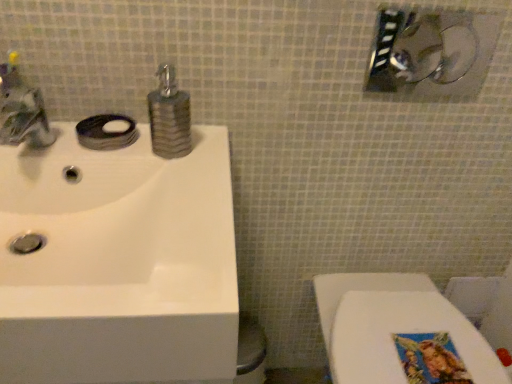
Question: Can you confirm if brushed metal faucet at upper left is smaller than brushed metal showerhead at upper right?

Choices:
 (A) yes
 (B) no

Answer: (B)

Question: Would you say brushed metal faucet at upper left is a long distance from brushed metal showerhead at upper right?

Choices:
 (A) yes
 (B) no

Answer: (B)

Question: Could you tell me if brushed metal faucet at upper left is turned towards brushed metal showerhead at upper right?

Choices:
 (A) yes
 (B) no

Answer: (B)

Question: Considering the relative sizes of brushed metal faucet at upper left and brushed metal showerhead at upper right in the image provided, is brushed metal faucet at upper left shorter than brushed metal showerhead at upper right?

Choices:
 (A) no
 (B) yes

Answer: (A)

Question: Is brushed metal faucet at upper left to the right of brushed metal showerhead at upper right from the viewer's perspective?

Choices:
 (A) yes
 (B) no

Answer: (B)

Question: Looking at the image, does white glossy sink at upper left seem bigger or smaller compared to brushed metal showerhead at upper right?

Choices:
 (A) small
 (B) big

Answer: (B)

Question: Considering the relative positions of white glossy sink at upper left and brushed metal showerhead at upper right in the image provided, is white glossy sink at upper left to the left or to the right of brushed metal showerhead at upper right?

Choices:
 (A) left
 (B) right

Answer: (A)

Question: From the image's perspective, relative to brushed metal showerhead at upper right, is white glossy sink at upper left above or below?

Choices:
 (A) above
 (B) below

Answer: (B)

Question: From a real-world perspective, is white glossy sink at upper left physically located above or below brushed metal showerhead at upper right?

Choices:
 (A) above
 (B) below

Answer: (B)

Question: Considering the positions of point [x=1, y=125] and point [x=229, y=248], is point [x=1, y=125] closer or farther from the camera than point [x=229, y=248]?

Choices:
 (A) closer
 (B) farther

Answer: (B)

Question: In terms of width, does brushed metal faucet at upper left look wider or thinner when compared to white glossy sink at upper left?

Choices:
 (A) wide
 (B) thin

Answer: (B)

Question: From their relative heights in the image, would you say brushed metal faucet at upper left is taller or shorter than white glossy sink at upper left?

Choices:
 (A) tall
 (B) short

Answer: (A)

Question: In the image, is brushed metal faucet at upper left on the left side or the right side of white glossy sink at upper left?

Choices:
 (A) right
 (B) left

Answer: (B)

Question: In terms of height, does brushed metal faucet at upper left look taller or shorter compared to textured brown soap dispenser at center?

Choices:
 (A) short
 (B) tall

Answer: (B)

Question: From a real-world perspective, relative to textured brown soap dispenser at center, is brushed metal faucet at upper left vertically above or below?

Choices:
 (A) below
 (B) above

Answer: (B)